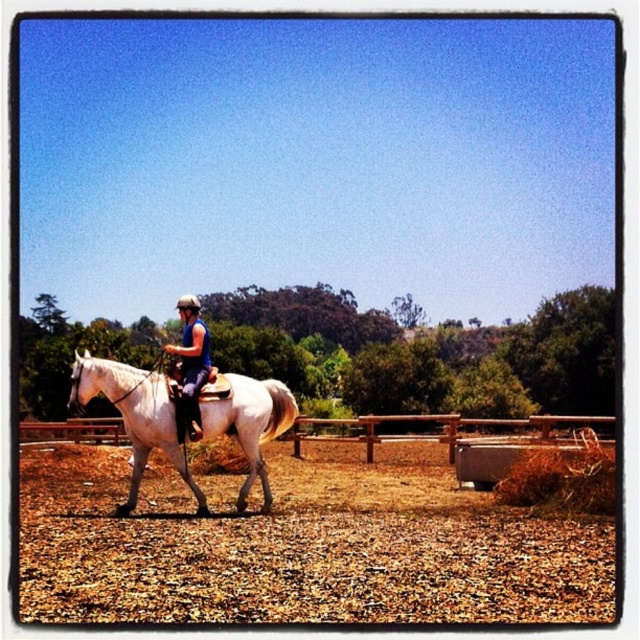
You are a photographer positioned to the left of the scene. You want to capture a photo of the white glossy horse at center and the brown gravelly dirt at center. Which object is closer to your left side?

The white glossy horse at center is closer to your left side because the brown gravelly dirt at center is to the right of the white glossy horse at center.

You are a photographer positioned at the edge of the paddock. You want to take a photo of the white glossy horse at center without the brown wooden fence at center appearing in the foreground. Is this possible given their positions?

The brown wooden fence at center is further to the viewer than the white glossy horse at center, so the horse is closer to you. To avoid the fence in the foreground, position yourself so the horse is between you and the fence. However, since the fence is already closer, it would block the horse. Thus, it is not possible to take the photo without the fence in the foreground.

Looking at this image, you are a drone operator tasked with capturing aerial footage of the rider and horse in the paddock. The drone must stay at least 20 meters away from any obstacles to avoid collisions. Given the distance between the brown wooden fence at center and the blue fabric helmet at center, can the drone safely fly between them without violating the safety distance?

The distance between the brown wooden fence at center and the blue fabric helmet at center is 18.90 meters. Since the drone must stay at least 20 meters away from obstacles, the gap is insufficient. The drone cannot safely fly between them without violating the safety distance requirement.